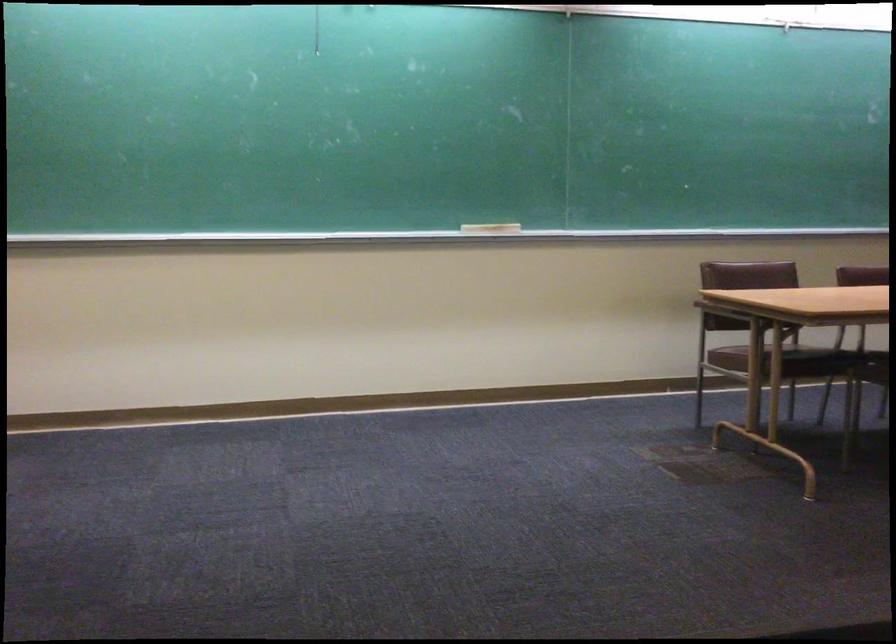
At what (x,y) coordinates should I click in order to perform the action: click on chair sitting surface. Please return your answer as a coordinate pair (x, y). The height and width of the screenshot is (644, 896). Looking at the image, I should click on (769, 355).